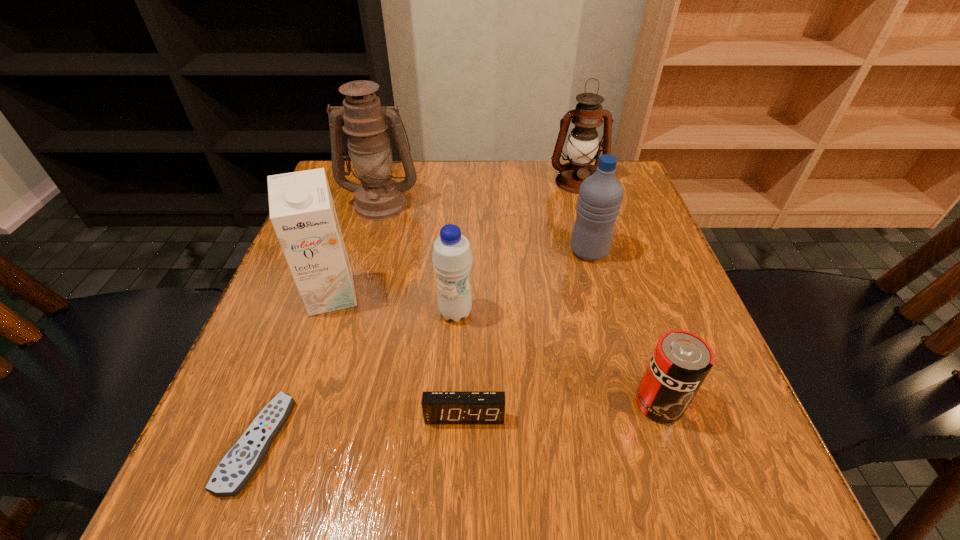
Where is `free space between the alarm clock and the nearer water bottle`? Image resolution: width=960 pixels, height=540 pixels. free space between the alarm clock and the nearer water bottle is located at coordinates (460, 364).

Where is `free space between the nearer water bottle and the second shortest object`? free space between the nearer water bottle and the second shortest object is located at coordinates (460, 364).

Point out which object is positioned as the sixth nearest to the left water bottle. Please provide its 2D coordinates. Your answer should be formatted as a tuple, i.e. [(x, y)], where the tuple contains the x and y coordinates of a point satisfying the conditions above.

[(681, 361)]

The height and width of the screenshot is (540, 960). Find the location of `object that stands as the sixth closest to the lantern`. object that stands as the sixth closest to the lantern is located at coordinates (438, 407).